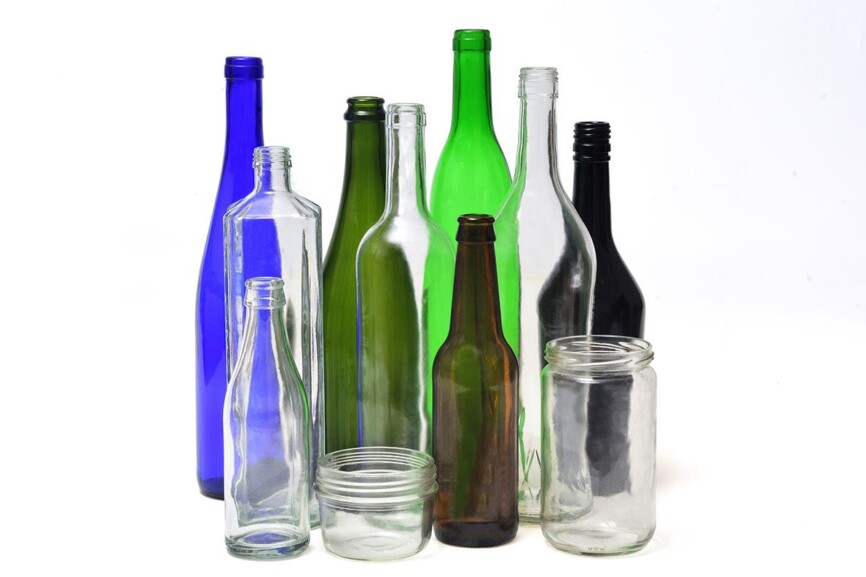
Locate an element on the screen. The image size is (866, 577). clear bottles is located at coordinates (267, 425), (260, 219), (377, 263), (554, 239).